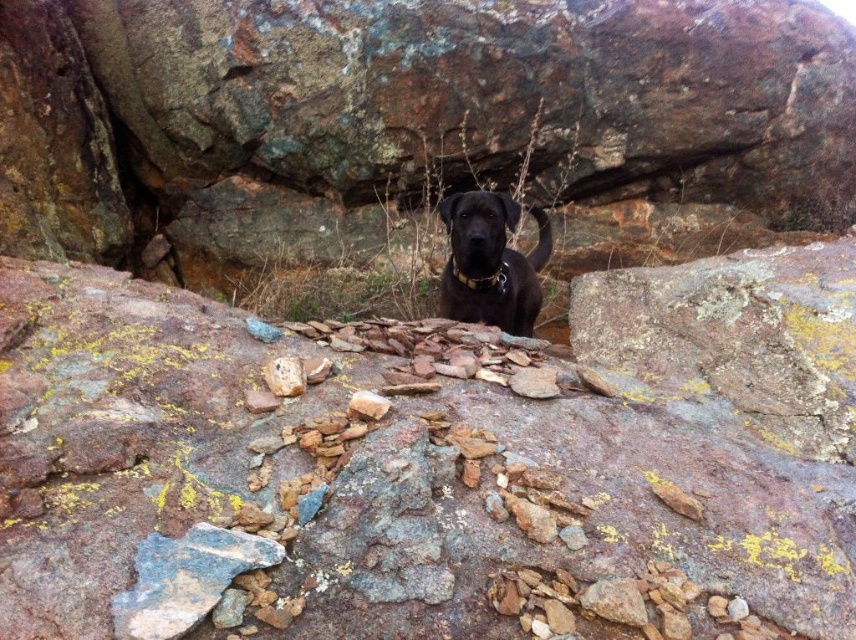
You are a hiker who wants to place a 20 cm wide backpack between the rusty rock at center and the shiny black dog at center. Can you fit it there?

The rusty rock at center might be wider than the shiny black dog at center, so there might be enough space for the 20 cm wide backpack between them.

You are standing at the point with coordinates point (503, 218) and want to reach the point with coordinates point (79, 561). Which direction should you move to get there?

You should move forward because point (79, 561) is in front of point (503, 218).